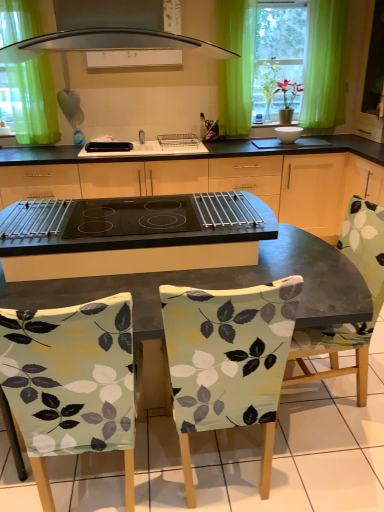
Question: Does point [46, 354] appear closer or farther from the camera than point [233, 105]?

Choices:
 (A) farther
 (B) closer

Answer: (B)

Question: Choose the correct answer: Is light green fabric chair at lower left, which is the 1th chair in left-to-right order, inside green sheer curtain at upper center, which ranks as the 2th curtain in left-to-right order, or outside it?

Choices:
 (A) inside
 (B) outside

Answer: (B)

Question: Which object is the farthest from the green fabric curtain at upper left, which is counted as the 1th curtain, starting from the left?

Choices:
 (A) black plastic toaster at center, placed as the 1th appliance when sorted from left to right
 (B) green sheer curtain at upper center, which ranks as the 2th curtain in left-to-right order
 (C) printed fabric chair at center, the 1th chair viewed from the right
 (D) patterned fabric chair at center, acting as the second chair starting from the right
 (E) white glossy bowl at center, positioned as the 2th appliance in left-to-right order

Answer: (D)

Question: Estimate the real-world distances between objects in this image. Which object is closer to the patterned fabric chair at center, acting as the second chair starting from the right?

Choices:
 (A) green fabric curtain at upper left, which is counted as the 1th curtain, starting from the left
 (B) green sheer curtain at upper center, which ranks as the 2th curtain in left-to-right order
 (C) black plastic toaster at center, placed as the 1th appliance when sorted from left to right
 (D) black glass cooktop at center
 (E) light green fabric chair at lower left, marked as the third chair in a right-to-left arrangement

Answer: (E)